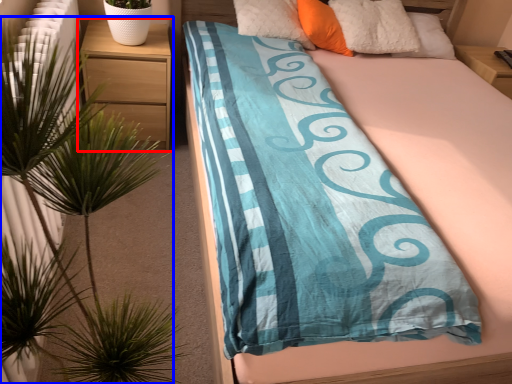
Question: Which of the following is the closest to the observer, nightstand (highlighted by a red box) or houseplant (highlighted by a blue box)?

Choices:
 (A) nightstand
 (B) houseplant

Answer: (B)